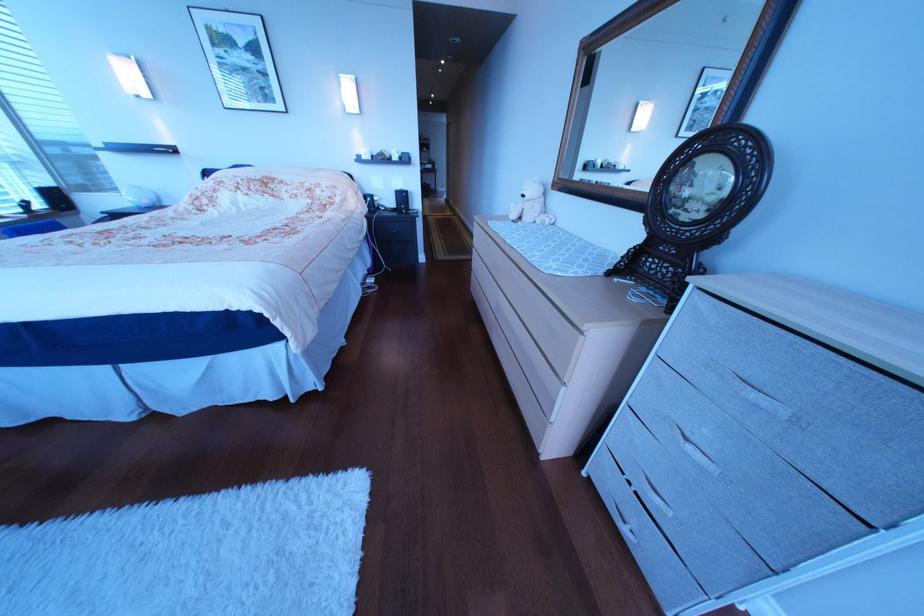
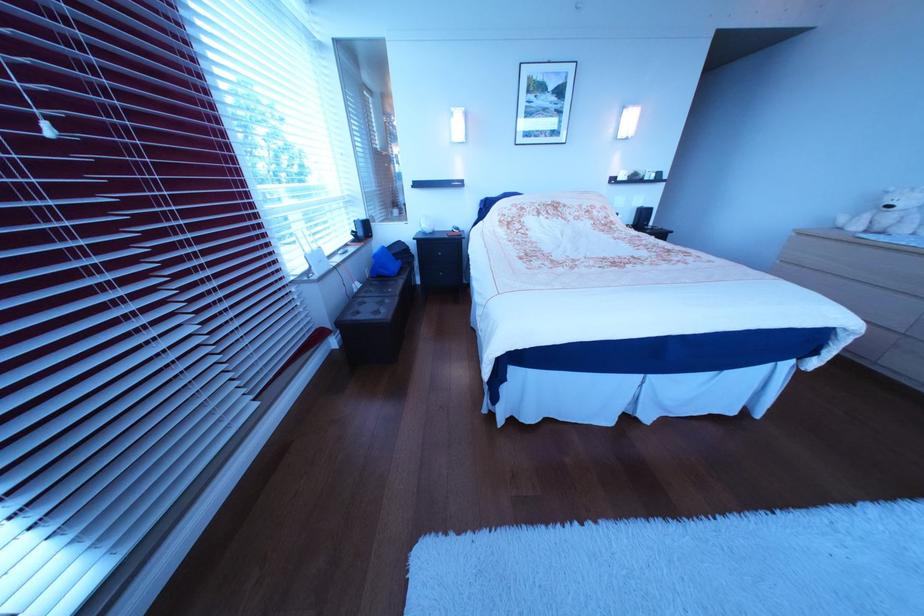
The point at (539, 198) is marked in the first image. Where is the corresponding point in the second image?

(906, 209)